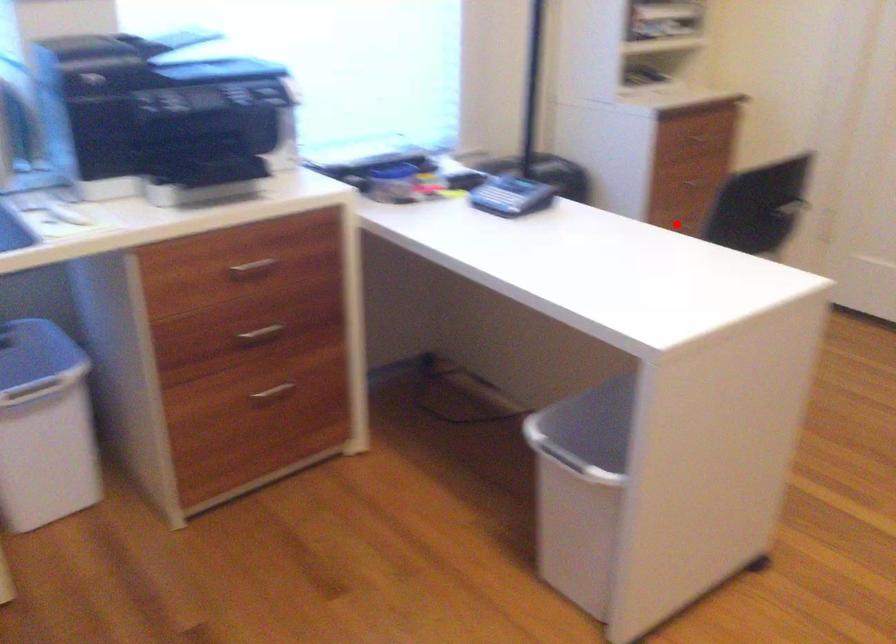
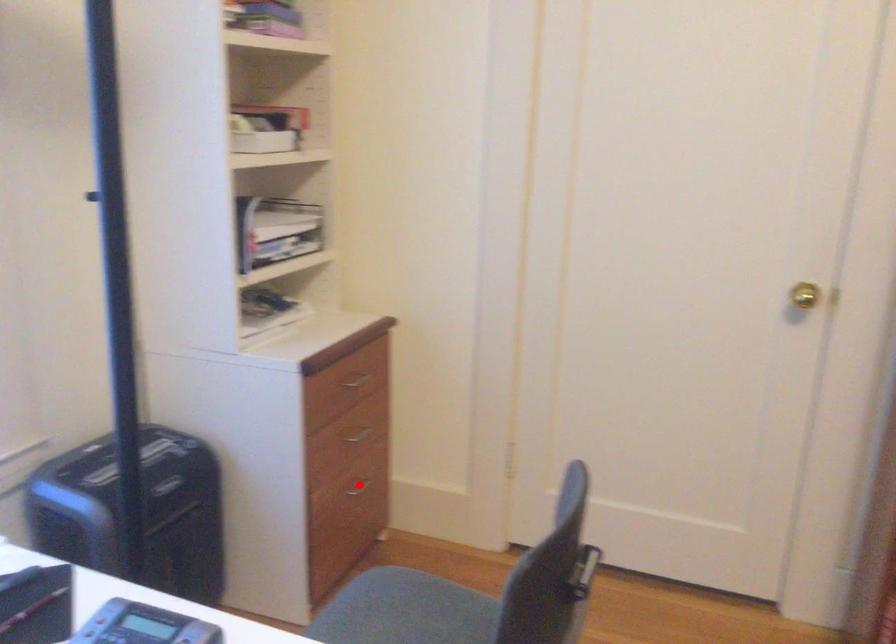
I am providing you with two images of the same scene from different viewpoints. A red point is marked on the first image and another point is marked on the second image. Is the red point in image1 aligned with the point shown in image2?

Yes